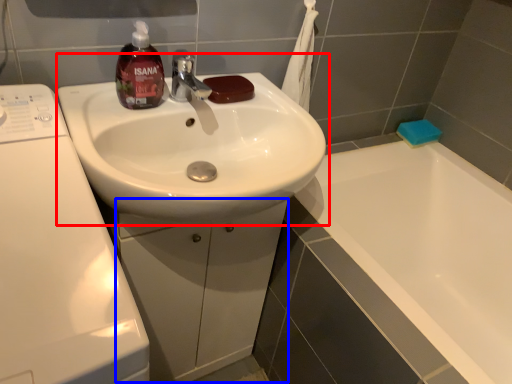
Question: Among these objects, which one is nearest to the camera, sink (highlighted by a red box) or drawer (highlighted by a blue box)?

Choices:
 (A) sink
 (B) drawer

Answer: (A)